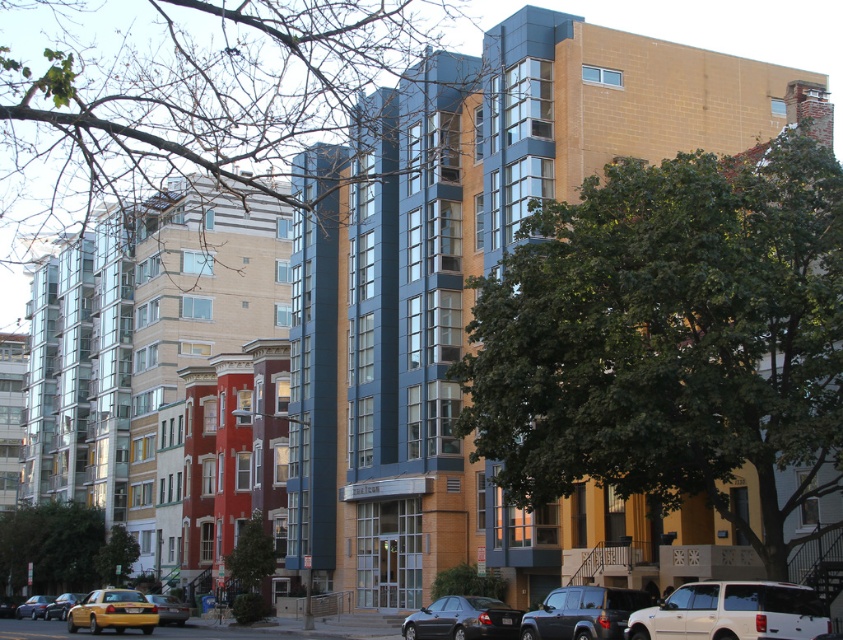
Question: Which object is the farthest from the yellow metallic taxi cab at lower left?

Choices:
 (A) shiny black sedan at lower center
 (B) yellow matte taxi cab at lower left
 (C) matte gray suv at lower center

Answer: (C)

Question: Is shiny black sedan at lower center smaller than metallic silver sedan at lower left?

Choices:
 (A) yes
 (B) no

Answer: (A)

Question: Based on their relative distances, which object is nearer to the yellow metallic taxi cab at lower left?

Choices:
 (A) shiny black sedan at lower center
 (B) yellow matte taxi cab at lower left
 (C) yellow matte taxi at lower left

Answer: (B)

Question: From the image, what is the correct spatial relationship of white matte suv at lower right in relation to yellow metallic taxi cab at lower left?

Choices:
 (A) right
 (B) left

Answer: (A)

Question: Which of the following is the closest to the observer?

Choices:
 (A) (407, 618)
 (B) (702, 589)

Answer: (B)

Question: Does white matte suv at lower right have a lesser width compared to metallic silver sedan at lower left?

Choices:
 (A) yes
 (B) no

Answer: (A)